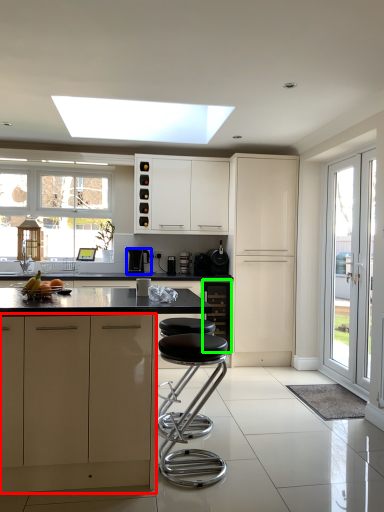
Question: Which object is the closest to the cabinetry (highlighted by a red box)? Choose among these: kitchen appliance (highlighted by a blue box) or cabinetry (highlighted by a green box).

Choices:
 (A) kitchen appliance
 (B) cabinetry

Answer: (B)